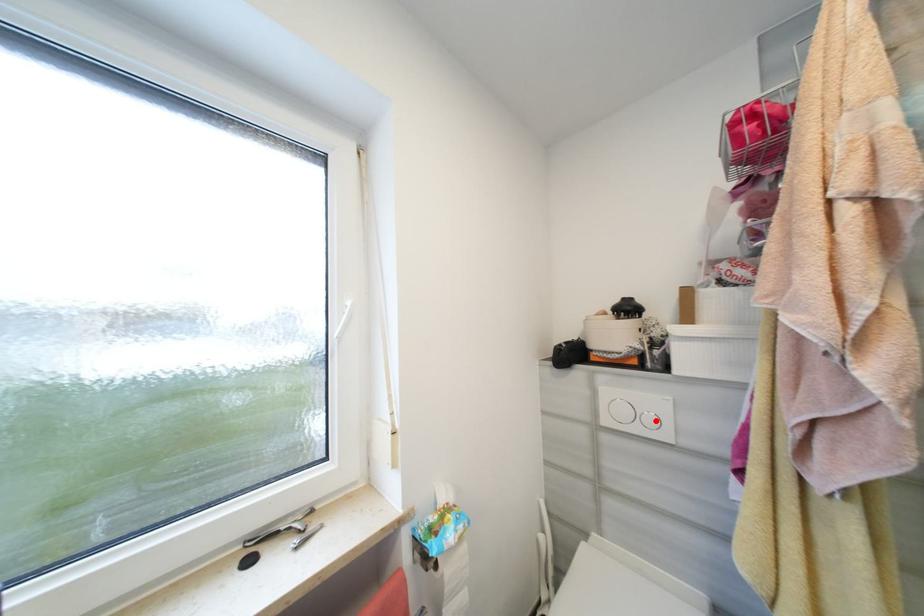
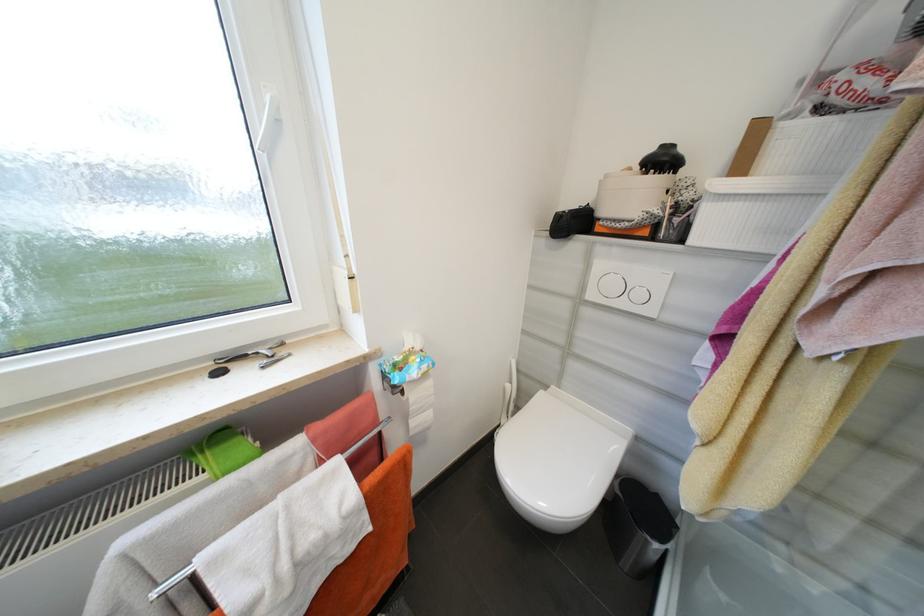
Locate, in the second image, the point that corresponds to the highlighted location in the first image.

(646, 296)